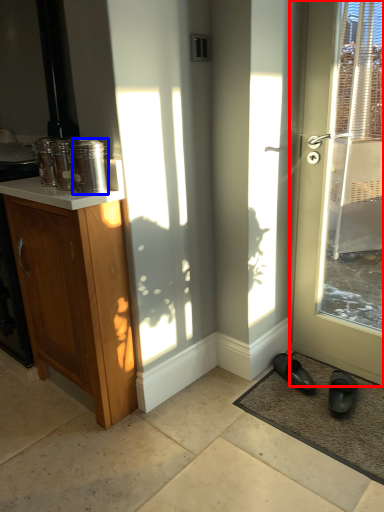
Question: Which of the following is the closest to the observer, door (highlighted by a red box) or glass jar (highlighted by a blue box)?

Choices:
 (A) door
 (B) glass jar

Answer: (A)